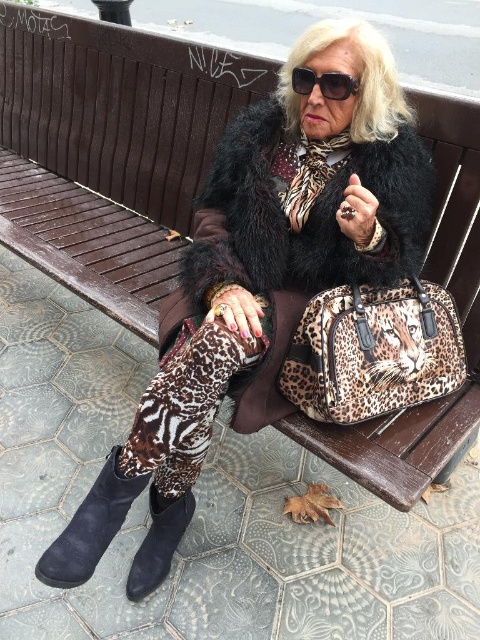
Question: Where is black suede boot at lower left located in relation to black plastic sunglasses at upper center in the image?

Choices:
 (A) below
 (B) above

Answer: (A)

Question: Is black furry coat at center bigger than leopard print fabric handbag at center?

Choices:
 (A) yes
 (B) no

Answer: (A)

Question: Among these points, which one is nearest to the camera?

Choices:
 (A) (345, 74)
 (B) (166, 570)
 (C) (410, 209)
 (D) (101, 538)

Answer: (D)

Question: Can you confirm if black furry coat at center is positioned below black suede boot at lower left?

Choices:
 (A) yes
 (B) no

Answer: (B)

Question: Among these objects, which one is nearest to the camera?

Choices:
 (A) suede boot at lower left
 (B) black furry coat at center
 (C) leopard print fabric handbag at center
 (D) black plastic sunglasses at upper center

Answer: (A)

Question: Which point is farther from the camera taking this photo?

Choices:
 (A) 159,538
 (B) 344,81
 (C) 240,243

Answer: (A)